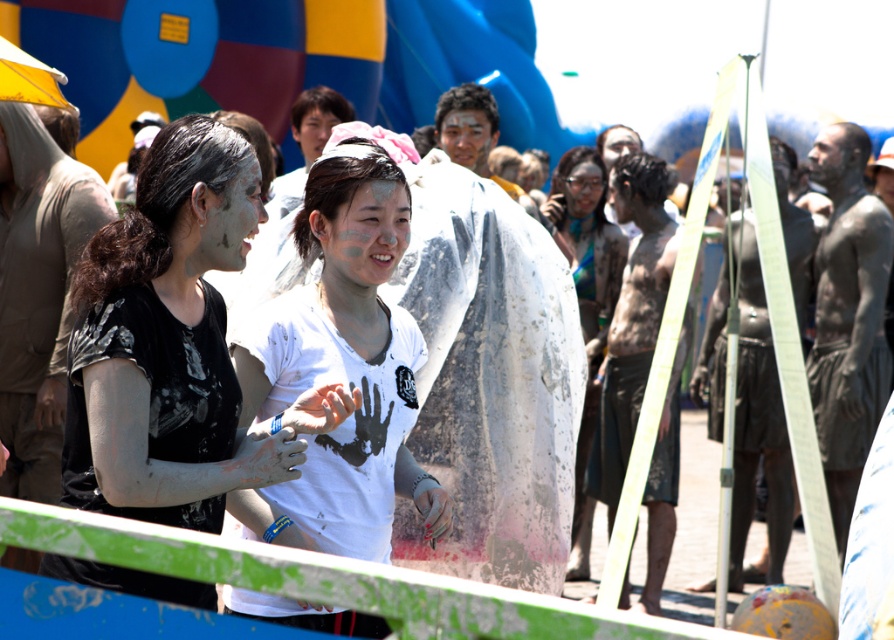
Question: Among these points, which one is nearest to the camera?

Choices:
 (A) (285, 612)
 (B) (608, 308)
 (C) (133, 256)

Answer: (C)

Question: Which object is farther from the camera taking this photo?

Choices:
 (A) matte black shirt at center
 (B) white matte t-shirt at center

Answer: (B)

Question: Does matte black shirt at center have a lesser width compared to white matte t-shirt at center?

Choices:
 (A) yes
 (B) no

Answer: (A)

Question: Estimate the real-world distances between objects in this image. Which object is closer to the white matte t-shirt at center?

Choices:
 (A) matte black shirt at center
 (B) matte white dress at center

Answer: (A)

Question: In this image, where is matte black shirt at center located relative to white matte t-shirt at center?

Choices:
 (A) right
 (B) left

Answer: (B)

Question: Is the position of matte black shirt at center more distant than that of white matte t-shirt at center?

Choices:
 (A) no
 (B) yes

Answer: (A)